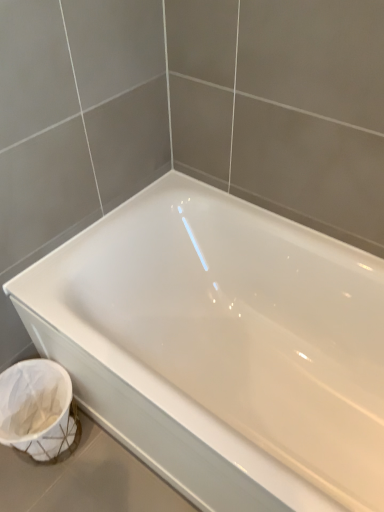
Question: Are white glossy bathtub at center and white woven laundry basket at lower left located far from each other?

Choices:
 (A) no
 (B) yes

Answer: (A)

Question: Does white glossy bathtub at center have a lesser width compared to white woven laundry basket at lower left?

Choices:
 (A) yes
 (B) no

Answer: (B)

Question: Is white glossy bathtub at center outside white woven laundry basket at lower left?

Choices:
 (A) yes
 (B) no

Answer: (A)

Question: Does white glossy bathtub at center touch white woven laundry basket at lower left?

Choices:
 (A) no
 (B) yes

Answer: (A)

Question: Can you confirm if white glossy bathtub at center is shorter than white woven laundry basket at lower left?

Choices:
 (A) no
 (B) yes

Answer: (A)

Question: From the image's perspective, does white glossy bathtub at center appear lower than white woven laundry basket at lower left?

Choices:
 (A) no
 (B) yes

Answer: (A)

Question: From the image's perspective, is white woven laundry basket at lower left below white glossy bathtub at center?

Choices:
 (A) yes
 (B) no

Answer: (A)

Question: Does white woven laundry basket at lower left have a greater width compared to white glossy bathtub at center?

Choices:
 (A) no
 (B) yes

Answer: (A)

Question: Is white woven laundry basket at lower left with white glossy bathtub at center?

Choices:
 (A) no
 (B) yes

Answer: (A)

Question: Considering the relative sizes of white woven laundry basket at lower left and white glossy bathtub at center in the image provided, is white woven laundry basket at lower left thinner than white glossy bathtub at center?

Choices:
 (A) no
 (B) yes

Answer: (B)

Question: Could you tell me if white woven laundry basket at lower left is turned towards white glossy bathtub at center?

Choices:
 (A) no
 (B) yes

Answer: (A)

Question: Is white woven laundry basket at lower left far from white glossy bathtub at center?

Choices:
 (A) no
 (B) yes

Answer: (A)

Question: Is white glossy bathtub at center situated inside white woven laundry basket at lower left or outside?

Choices:
 (A) inside
 (B) outside

Answer: (B)